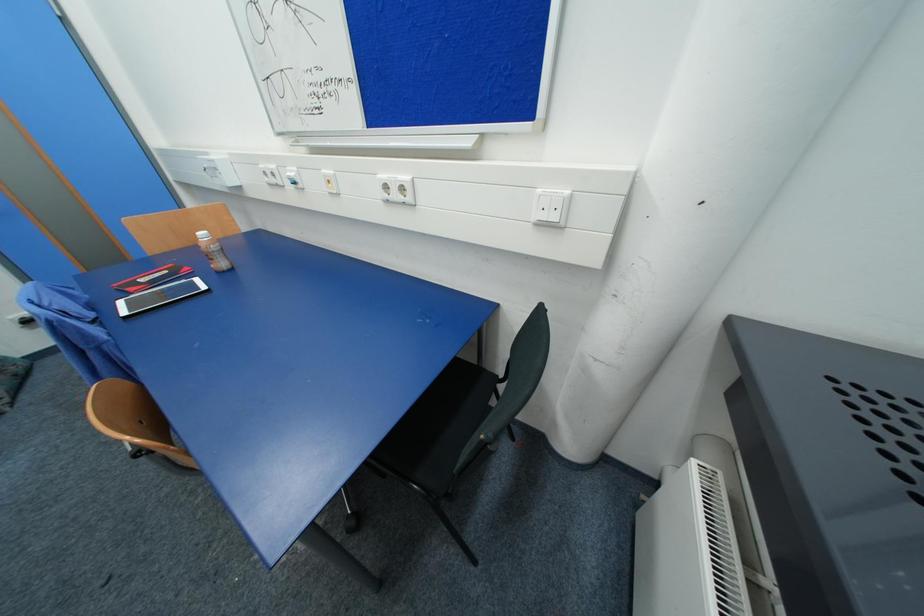
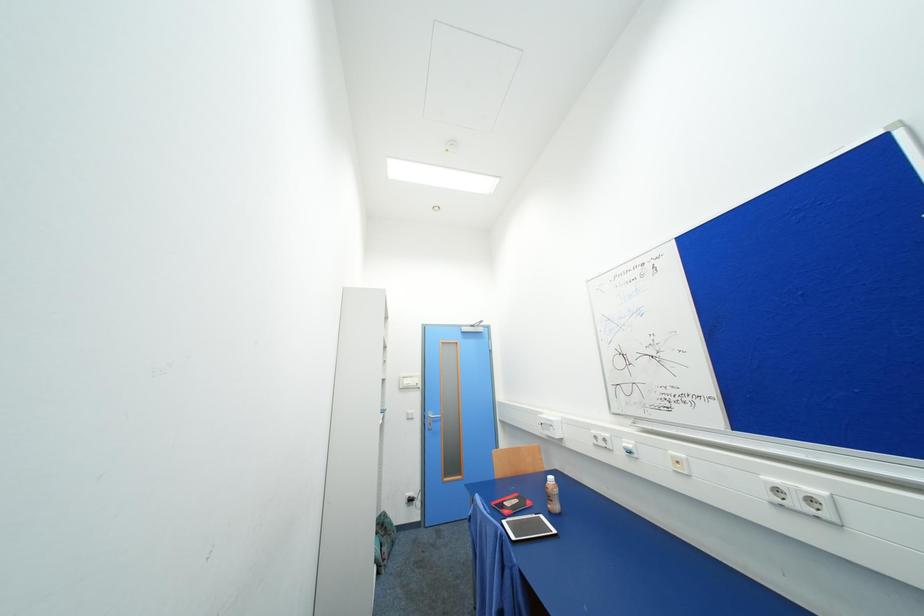
First-person continuous shooting, in which direction is the camera rotating?

The camera's rotation is toward left-up.